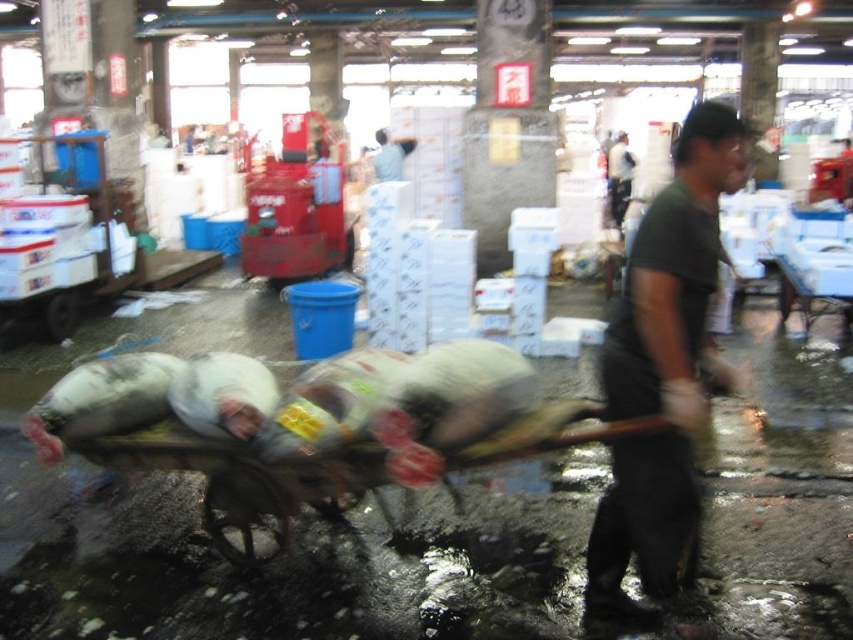
You are a customer at the market and want to approach both the dark green shirt at center and the light blue shirt at center to ask about prices. Which seller should you approach first if you want to start with the one who is closer to you?

The dark green shirt at center is closer to you because it occupies less space than the light blue shirt at center, indicating it is nearer.